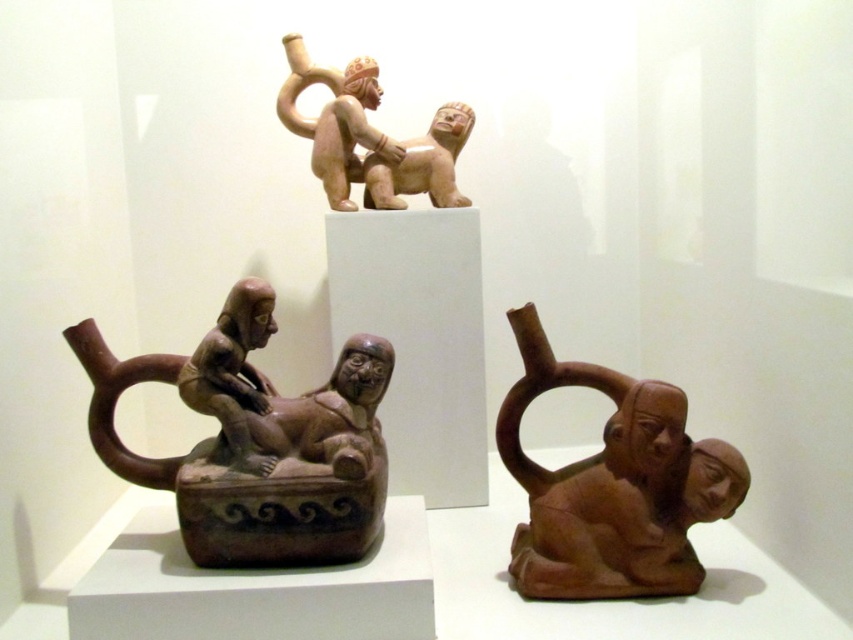
You are an archaeologist examining the top figurine. You notice two points marked on it. Point A is at coordinates point (x=323, y=554) and Point B is at point (x=683, y=548). Which point is closer to you?

Point A at point (x=323, y=554) is closer to you than Point B at point (x=683, y=548).

You are an archaeologist examining the image. You need to locate the brown clay figure at center. What are its coordinates in the image?

The brown clay figure at center is located at coordinates (612, 484).

You are an archaeologist examining the two figurines on the highest pedestal. You need to place a protective barrier between them to prevent damage. Given that the barrier requires at least 30 inches of space to be effective, will the current distance between the brown matte clay figure at center and the matte beige figure at upper center allow for this?

The distance between the brown matte clay figure at center and the matte beige figure at upper center is 35.47 inches, which is more than the required 30 inches. Therefore, the protective barrier can be placed between them effectively.